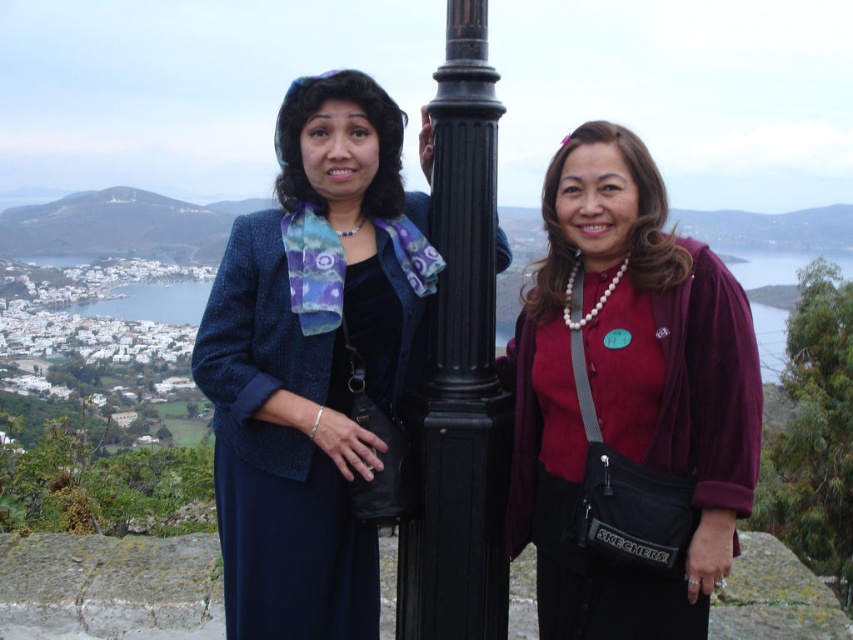
Between velvet maroon blouse at center and black metal pole at center, which one is positioned higher?

black metal pole at center

Does velvet maroon blouse at center have a greater width compared to black metal pole at center?

Yes.

Image resolution: width=853 pixels, height=640 pixels. Describe the element at coordinates (627, 404) in the screenshot. I see `velvet maroon blouse at center` at that location.

Locate an element on the screen. The width and height of the screenshot is (853, 640). velvet maroon blouse at center is located at coordinates (627, 404).

Which is more to the right, velvet blue dress at center or black metal pole at center?

black metal pole at center

Is point (320, 401) closer to camera compared to point (489, 132)?

That is False.

The height and width of the screenshot is (640, 853). I want to click on velvet blue dress at center, so click(312, 362).

Who is positioned more to the left, velvet maroon blouse at center or velvet blue dress at center?

velvet blue dress at center

Find the location of `velvet maroon blouse at center`. velvet maroon blouse at center is located at coordinates (627, 404).

Which is in front, point (596, 532) or point (300, 476)?

Positioned in front is point (596, 532).

Identify the location of velvet maroon blouse at center. This screenshot has height=640, width=853. (627, 404).